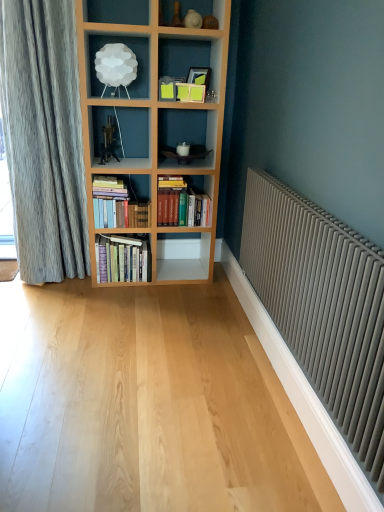
Question: Relative to hardcover books at center, the third book positioned from the right, is white cloud lamp at upper center in front or behind?

Choices:
 (A) front
 (B) behind

Answer: (A)

Question: Is white cloud lamp at upper center situated inside hardcover books at center, which ranks as the first book in left-to-right order, or outside?

Choices:
 (A) inside
 (B) outside

Answer: (B)

Question: Which of these objects is positioned closest to the hardcover books at center, which is the first book in right-to-left order?

Choices:
 (A) matte gray radiator at right
 (B) hardcover books at center, the 2th book from the left
 (C) hardcover books at center, which ranks as the first book in left-to-right order
 (D) white cloud lamp at upper center

Answer: (B)

Question: Based on their relative distances, which object is farther from the hardcover books at center, which is counted as the 2th book, starting from the right?

Choices:
 (A) hardcover books at center, which ranks as the first book in left-to-right order
 (B) white cloud lamp at upper center
 (C) hardcover books at center, positioned as the third book in left-to-right order
 (D) matte gray radiator at right

Answer: (D)